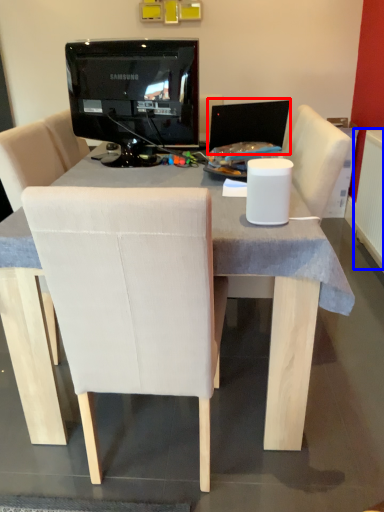
Question: Which point is further to the camera, computer monitor (highlighted by a red box) or radiator (highlighted by a blue box)?

Choices:
 (A) computer monitor
 (B) radiator

Answer: (B)